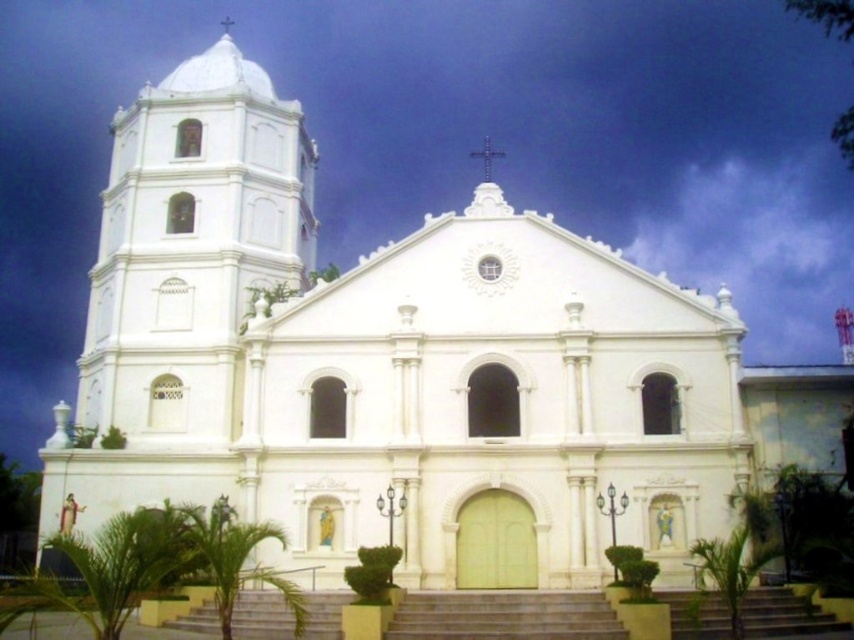
You are a drone operator tasked with capturing aerial footage of the church. Your drone needs to fly from the white smooth tower at left to the white stone cross at upper center. What is the approximate distance the drone must travel between these two points?

The distance between the white smooth tower at left and the white stone cross at upper center is 34.20 meters, so the drone must travel approximately 34.20 meters to reach the cross from the tower.

Based on the photo, you are standing in front of the church and want to take a photo of the white stone cross at upper center. However, there are smooth concrete stairs at center blocking your view. Based on their heights, can you determine if you need to move closer or farther away to see the cross without the stairs obstructing it?

The smooth concrete stairs at center is not as tall as the white stone cross at upper center. To avoid the stairs obstructing the view of the cross, you should move farther away so that the cross becomes visible above the stairs.

Based on the photo, you are standing in front of the church and want to take a photo of both the white smooth tower at left and the white stone cross at upper center. Which object should you look at first to ensure both are in frame?

You should look at the white stone cross at upper center first because the white smooth tower at left is above it, so adjusting the camera angle to include the tower will naturally include the cross as well.